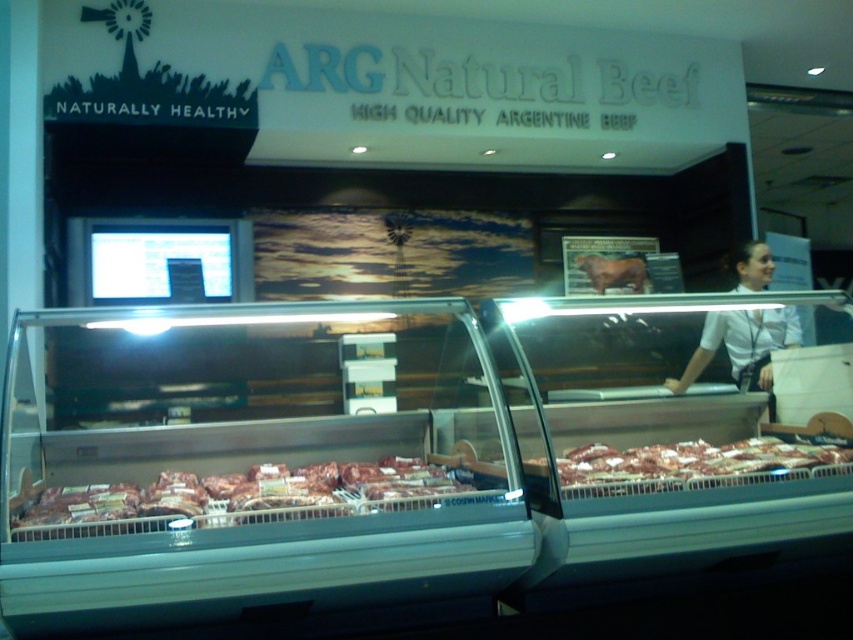
Question: Based on their relative distances, which object is nearer to the red meat at center?

Choices:
 (A) raw red meat at center
 (B) white shirt at upper right

Answer: (A)

Question: Considering the relative positions of red meat at center and white shirt at upper right in the image provided, where is red meat at center located with respect to white shirt at upper right?

Choices:
 (A) right
 (B) left

Answer: (B)

Question: Does red meat at center appear over raw red meat at center?

Choices:
 (A) yes
 (B) no

Answer: (B)

Question: Which is nearer to the raw red meat at center?

Choices:
 (A) white shirt at upper right
 (B) red meat at center

Answer: (B)

Question: Which point is farther to the camera?

Choices:
 (A) (143, 529)
 (B) (738, 285)
 (C) (756, 468)

Answer: (B)

Question: Is raw red meat at center positioned at the back of white shirt at upper right?

Choices:
 (A) no
 (B) yes

Answer: (A)